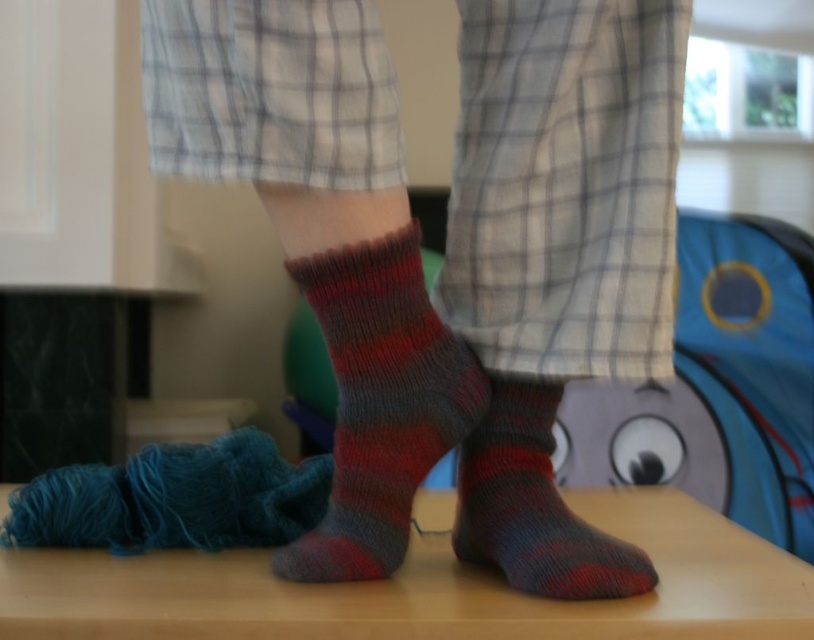
Question: Estimate the real-world distances between objects in this image. Which object is closer to the knitted woolen sock at center?

Choices:
 (A) knitted wool socks at center
 (B) knitted wool sock at center

Answer: (A)

Question: Is knitted wool socks at center below knitted wool sock at center?

Choices:
 (A) no
 (B) yes

Answer: (A)

Question: Is the position of knitted wool socks at center less distant than that of knitted woolen sock at center?

Choices:
 (A) yes
 (B) no

Answer: (A)

Question: Which of the following is the farthest from the observer?

Choices:
 (A) knitted woolen sock at center
 (B) knitted wool socks at center

Answer: (A)

Question: Considering the real-world distances, which object is farthest from the knitted wool socks at center?

Choices:
 (A) knitted wool sock at center
 (B) knitted woolen sock at center

Answer: (A)

Question: Does knitted wool socks at center have a smaller size compared to knitted wool sock at center?

Choices:
 (A) no
 (B) yes

Answer: (A)